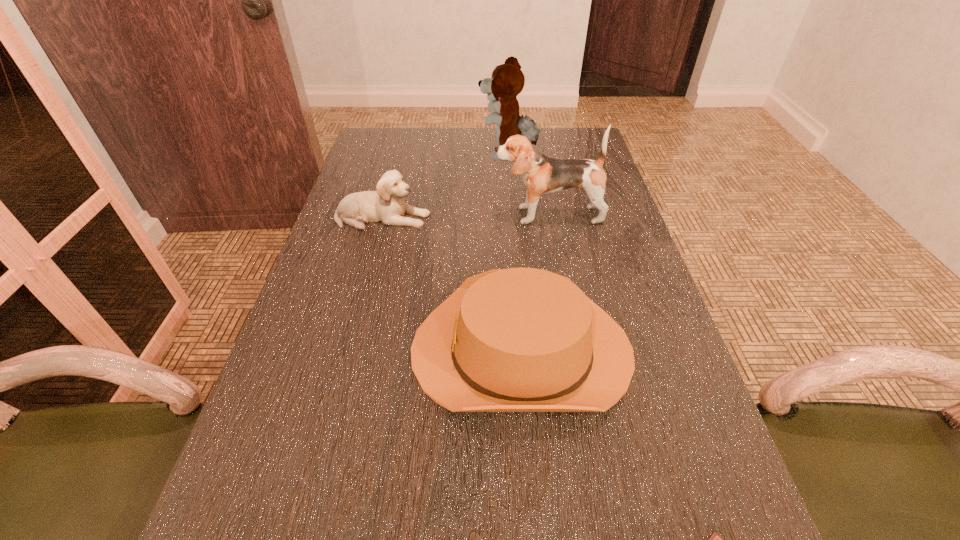
The height and width of the screenshot is (540, 960). In order to click on the farthest object in this screenshot , I will do `click(507, 80)`.

You are a GUI agent. You are given a task and a screenshot of the screen. Output one action in this format:
    pyautogui.click(x=<x>, y=<y>)
    Task: Click on the shortest puppy
    This screenshot has width=960, height=540.
    Given the screenshot: What is the action you would take?
    pyautogui.click(x=387, y=205)

The image size is (960, 540). I want to click on cowboy hat, so click(520, 339).

Where is `vacant space located on the face of the farthest object`? vacant space located on the face of the farthest object is located at coordinates (390, 156).

Identify the location of free spot located 0.240m on the face of the farthest object. This screenshot has width=960, height=540. (402, 156).

The height and width of the screenshot is (540, 960). I want to click on free space located on the face of the farthest object, so click(x=399, y=156).

At what (x,y) coordinates should I click in order to perform the action: click on vacant space located 0.370m on the front-facing side of the leftmost puppy. Please return your answer as a coordinate pair (x, y). Looking at the image, I should click on (571, 218).

The height and width of the screenshot is (540, 960). What are the coordinates of `free region located on the front-facing side of the second nearest object` in the screenshot? It's located at (365, 350).

The image size is (960, 540). I want to click on vacant space located 0.230m on the front-facing side of the second nearest object, so click(x=292, y=350).

Image resolution: width=960 pixels, height=540 pixels. I want to click on free space located on the front-facing side of the second nearest object, so click(x=292, y=350).